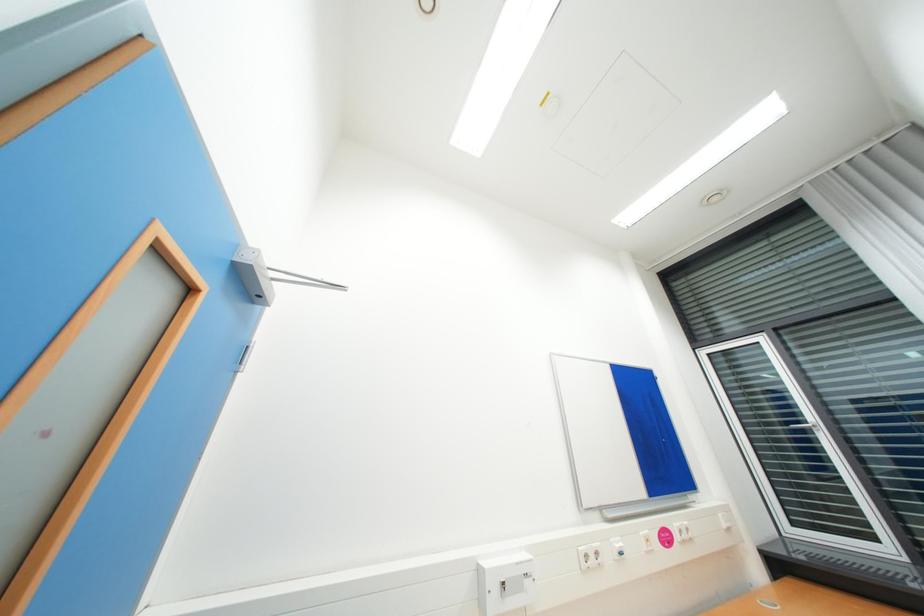
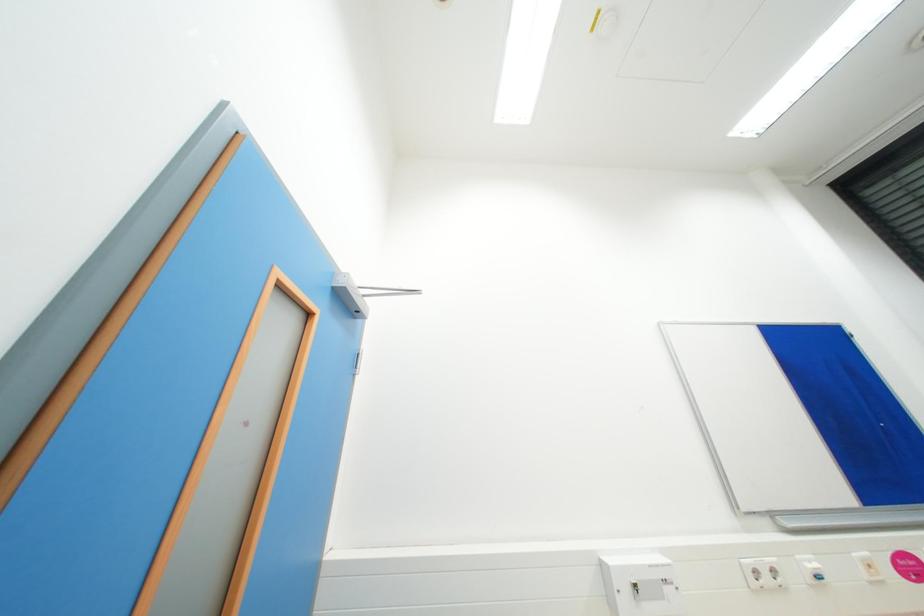
Question: Based on the continuous images, in which direction is the camera rotating? Reply with the corresponding letter.

Choices:
 (A) Left
 (B) Right
 (C) Up
 (D) Down

Answer: (A)